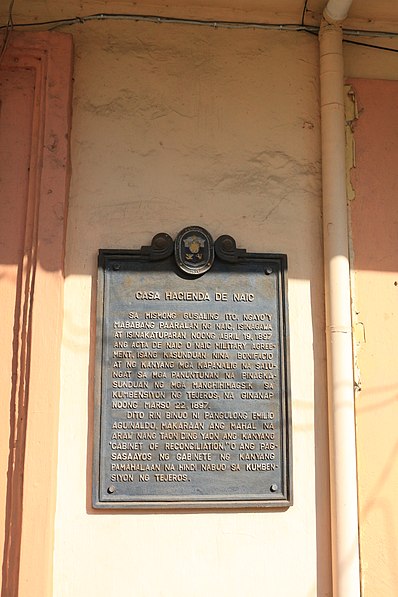
At what (x,y) coordinates should I click in order to perform the action: click on plaque. Please return your answer as a coordinate pair (x, y). Looking at the image, I should click on (225, 286).